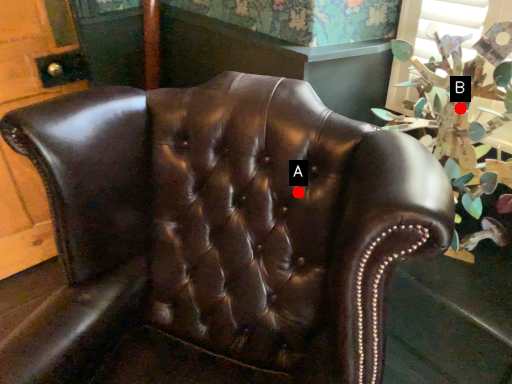
Question: Two points are circled on the image, labeled by A and B beside each circle. Which point is closer to the camera?

Choices:
 (A) A is closer
 (B) B is closer

Answer: (A)